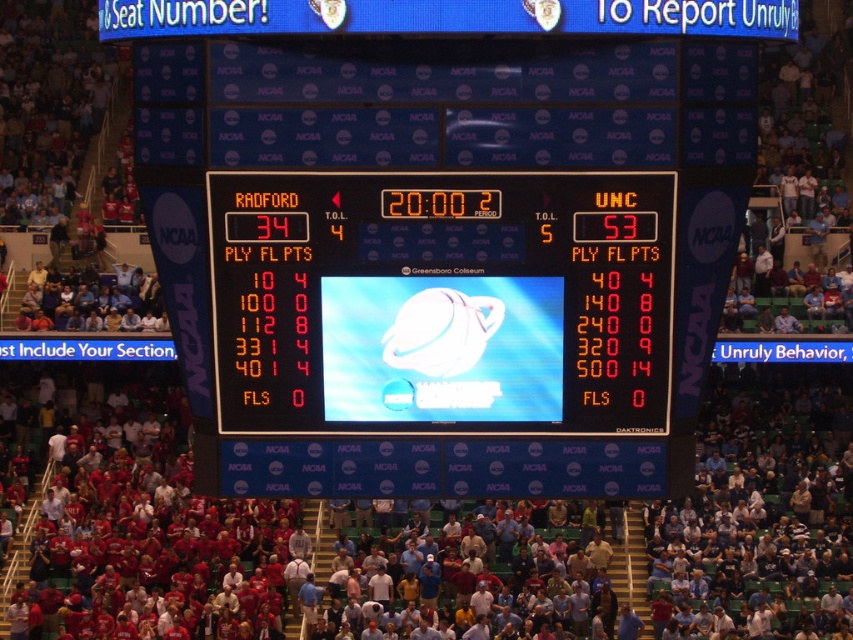
You are a sports analyst watching the game at Greensboro Coliseum. You notice the orange digital scoreboard at center and the shiny blue planet at center. Which object is wider?

The orange digital scoreboard at center is wider than the shiny blue planet at center.

You are a spectator at the Greensboro Coliseum basketball game. You notice the orange digital scoreboard at center and the shiny blue planet at center. Which object is positioned closer to you?

The orange digital scoreboard at center is closer to the viewer than the shiny blue planet at center.